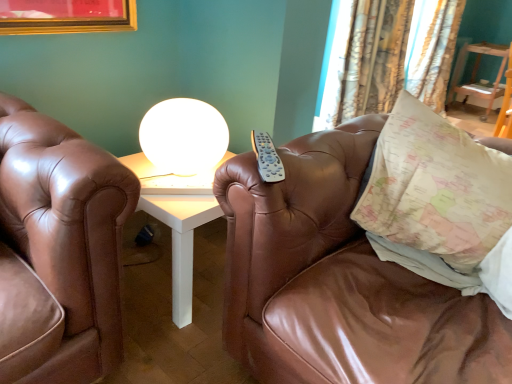
Question: In terms of height, does brown leather couch at center look taller or shorter compared to patterned fabric curtain at upper right, the 2th curtain positioned from the back?

Choices:
 (A) short
 (B) tall

Answer: (A)

Question: Is brown leather couch at center spatially inside patterned fabric curtain at upper right, which is the 1th curtain from left to right, or outside of it?

Choices:
 (A) outside
 (B) inside

Answer: (A)

Question: Which is farther from the wooden table at upper right?

Choices:
 (A) patterned fabric curtain at upper right, which is the 1th curtain from left to right
 (B) white glossy sphere at upper center
 (C) patterned fabric curtain at upper right, the 2th curtain in the left-to-right sequence
 (D) brown leather couch at center
 (E) map-patterned fabric pillow at right

Answer: (D)

Question: Based on their relative distances, which object is nearer to the wooden table at upper right?

Choices:
 (A) map-patterned fabric pillow at right
 (B) patterned fabric curtain at upper right, acting as the 2th curtain starting from the right
 (C) brown leather couch at center
 (D) white glossy sphere at upper center
 (E) patterned fabric curtain at upper right, which ranks as the first curtain in back-to-front order

Answer: (E)